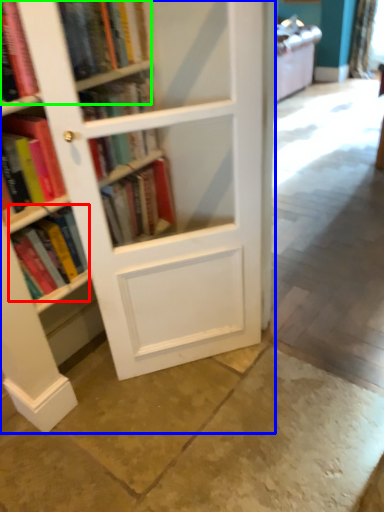
Question: Which object is positioned farthest from book (highlighted by a red box)? Select from bookcase (highlighted by a blue box) and book (highlighted by a green box).

Choices:
 (A) bookcase
 (B) book

Answer: (B)